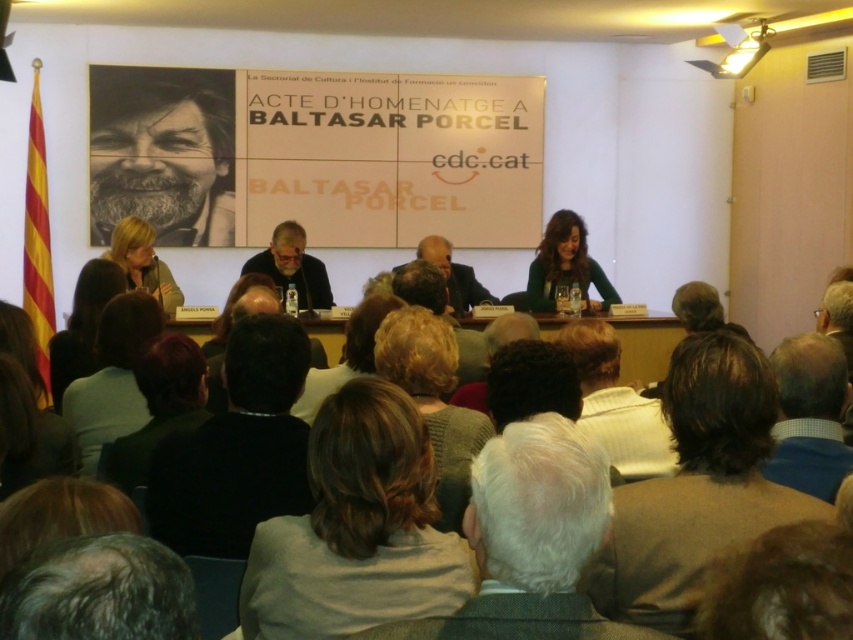
Question: Which point is closer to the camera?

Choices:
 (A) (155, 544)
 (B) (685, 301)
 (C) (137, 236)

Answer: (A)

Question: Which of the following is the closest to the observer?

Choices:
 (A) (264, 324)
 (B) (730, 435)
 (C) (453, 394)

Answer: (B)

Question: In this image, where is brown woolen sweater at lower right located relative to black fabric jacket at lower center?

Choices:
 (A) below
 (B) above

Answer: (B)

Question: Can you confirm if light brown hair at lower left is bigger than dark brown hair at lower center?

Choices:
 (A) yes
 (B) no

Answer: (A)

Question: Is light brown hair at center above light brown hair at lower right?

Choices:
 (A) no
 (B) yes

Answer: (A)

Question: Which object appears farthest from the camera in this image?

Choices:
 (A) brown woolen sweater at lower right
 (B) dark suit at center

Answer: (B)